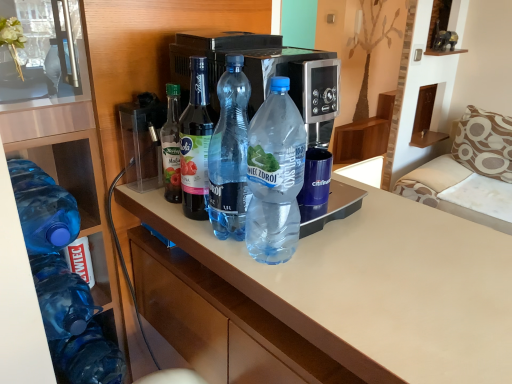
Measure the distance between blue translucent bottle at center, which is counted as the 5th bottle, starting from the left, and camera.

blue translucent bottle at center, which is counted as the 5th bottle, starting from the left, and camera are 24.75 inches apart from each other.

At what (x,y) coordinates should I click in order to perform the action: click on blue plastic bottles at left. Please return your answer as a coordinate pair (x, y). Looking at the image, I should click on (66, 140).

This screenshot has height=384, width=512. Describe the element at coordinates (66, 140) in the screenshot. I see `blue plastic bottles at left` at that location.

What do you see at coordinates (229, 153) in the screenshot? I see `transparent plastic bottle at center, the second bottle when ordered from right to left` at bounding box center [229, 153].

Find the location of a particular element. The width and height of the screenshot is (512, 384). blue translucent bottle at center, which appears as the 1th bottle when viewed from the right is located at coordinates (275, 176).

Is point (213, 120) less distant than point (213, 226)?

Yes, point (213, 120) is in front of point (213, 226).

Could you measure the distance between transparent plastic bottle at center, which is the 3th bottle from left to right, and transparent plastic bottle at center, the 4th bottle when ordered from left to right?

The distance of transparent plastic bottle at center, which is the 3th bottle from left to right, from transparent plastic bottle at center, the 4th bottle when ordered from left to right, is 7.46 centimeters.

Is transparent plastic bottle at center, the 4th bottle when ordered from left to right, located within transparent plastic bottle at center, which is counted as the third bottle, starting from the right?

That's incorrect, transparent plastic bottle at center, the 4th bottle when ordered from left to right, is not inside transparent plastic bottle at center, which is counted as the third bottle, starting from the right.

Locate an element on the screen. bottle that is the 1st one when counting downward from the transparent plastic container at upper left (from the image's perspective) is located at coordinates (196, 142).

Is transparent plastic container at upper left at the back of transparent plastic bottle at center, which is the 3th bottle from left to right?

That's right, transparent plastic bottle at center, which is the 3th bottle from left to right, is facing away from transparent plastic container at upper left.

Considering the relative sizes of transparent plastic bottle at center, which is counted as the third bottle, starting from the right, and transparent plastic container at upper left in the image provided, is transparent plastic bottle at center, which is counted as the third bottle, starting from the right, smaller than transparent plastic container at upper left?

Correct, transparent plastic bottle at center, which is counted as the third bottle, starting from the right, occupies less space than transparent plastic container at upper left.

Does point (67, 334) come in front of point (13, 181)?

No, it is behind (13, 181).

Is blue translucent bottle at left, which ranks as the 4th bottle in right-to-left order, at the left side of blue translucent bottle at left, the 1th bottle in the left-to-right sequence?

No.

Based on the photo, is blue translucent bottle at left, the 1th bottle in the left-to-right sequence, completely or partially inside blue translucent bottle at left, which ranks as the 4th bottle in right-to-left order?

No, blue translucent bottle at left, the 1th bottle in the left-to-right sequence, is not surrounded by blue translucent bottle at left, which ranks as the 4th bottle in right-to-left order.

This screenshot has height=384, width=512. In the image, there is a transparent plastic container at upper left. What are the coordinates of `furniture below it (from the image's perspective)` in the screenshot? It's located at (470, 173).

From a real-world perspective, is beige fabric sofa at right physically above transparent plastic container at upper left?

Incorrect, from a real-world perspective, beige fabric sofa at right is lower than transparent plastic container at upper left.

Based on the photo, does beige fabric sofa at right have a lesser width compared to transparent plastic container at upper left?

In fact, beige fabric sofa at right might be wider than transparent plastic container at upper left.

From the picture: Could you tell me if beige fabric sofa at right is turned towards transparent plastic container at upper left?

Yes.

Is transparent plastic bottle at center, which is the 3th bottle from left to right, in contact with blue plastic bottles at left?

transparent plastic bottle at center, which is the 3th bottle from left to right, and blue plastic bottles at left are clearly separated.

From a real-world perspective, which is physically below, transparent plastic bottle at center, which is the 3th bottle from left to right, or blue plastic bottles at left?

blue plastic bottles at left, from a real-world perspective.

Is transparent plastic bottle at center, which is counted as the third bottle, starting from the right, wider or thinner than blue plastic bottles at left?

Considering their sizes, transparent plastic bottle at center, which is counted as the third bottle, starting from the right, looks slimmer than blue plastic bottles at left.

Is blue plastic bottles at left located within transparent plastic bottle at center, which is counted as the third bottle, starting from the right?

Actually, blue plastic bottles at left is outside transparent plastic bottle at center, which is counted as the third bottle, starting from the right.

Which object is further away from the camera, transparent plastic bottle at center, the 4th bottle when ordered from left to right, or transparent plastic container at upper left?

transparent plastic container at upper left is further from the camera.

Between transparent plastic bottle at center, the second bottle when ordered from right to left, and transparent plastic container at upper left, which one has less height?

With less height is transparent plastic container at upper left.

From a real-world perspective, between transparent plastic bottle at center, the second bottle when ordered from right to left, and transparent plastic container at upper left, who is vertically lower?

transparent plastic container at upper left is physically lower.

In terms of width, does translucent plastic bottles at center look wider or thinner when compared to brown printed fabric pillow at right?

translucent plastic bottles at center is wider than brown printed fabric pillow at right.

Which is in front, point (115, 195) or point (463, 139)?

The point (115, 195) is more forward.

Would you say translucent plastic bottles at center is outside brown printed fabric pillow at right?

translucent plastic bottles at center is positioned outside brown printed fabric pillow at right.

From the image's perspective, starting from the transparent plastic bottle at center, which is the 3th bottle from left to right, which bottle is the 1st one below? Please provide its 2D coordinates.

[(229, 153)]

The height and width of the screenshot is (384, 512). I want to click on appliance behind the transparent plastic bottle at center, which is the 3th bottle from left to right, so click(x=142, y=141).

Which object lies nearer to the anchor point blue translucent bottle at left, placed as the second bottle when sorted from left to right, beige fabric sofa at right or blue translucent bottle at center, which is counted as the 5th bottle, starting from the left?

The object closer to blue translucent bottle at left, placed as the second bottle when sorted from left to right, is blue translucent bottle at center, which is counted as the 5th bottle, starting from the left.

Looking at the image, which one is located further to transparent plastic bottle at center, the second bottle when ordered from right to left, brown printed fabric pillow at right or translucent plastic bottles at center?

The object further to transparent plastic bottle at center, the second bottle when ordered from right to left, is brown printed fabric pillow at right.

Estimate the real-world distances between objects in this image. Which object is closer to brown printed fabric pillow at right, transparent plastic container at upper left or translucent plastic bottles at center?

translucent plastic bottles at center is closer to brown printed fabric pillow at right.

Based on the photo, when comparing their distances from transparent plastic container at upper left, does blue translucent bottle at left, the 1th bottle in the left-to-right sequence, or blue plastic bottles at left seem further?

blue translucent bottle at left, the 1th bottle in the left-to-right sequence.

Based on their spatial positions, is translucent plastic bottles at center or transparent plastic container at upper left further from beige fabric sofa at right?

transparent plastic container at upper left is positioned further to the anchor beige fabric sofa at right.

Based on their spatial positions, is blue translucent bottle at left, the 1th bottle in the left-to-right sequence, or transparent plastic bottle at center, which is counted as the third bottle, starting from the right, further from transparent plastic bottle at center, the second bottle when ordered from right to left?

blue translucent bottle at left, the 1th bottle in the left-to-right sequence, is positioned further to the anchor transparent plastic bottle at center, the second bottle when ordered from right to left.

Considering their positions, is blue translucent bottle at left, the 5th bottle viewed from the right, positioned closer to transparent plastic container at upper left than transparent plastic bottle at center, which is the 3th bottle from left to right?

transparent plastic bottle at center, which is the 3th bottle from left to right.

Based on their spatial positions, is translucent plastic bottles at center or transparent plastic container at upper left closer to transparent plastic bottle at center, the second bottle when ordered from right to left?

translucent plastic bottles at center lies closer to transparent plastic bottle at center, the second bottle when ordered from right to left, than the other object.

This screenshot has width=512, height=384. Identify the location of cabinetry between blue translucent bottle at left, the 5th bottle viewed from the right, and blue translucent bottle at left, which ranks as the 4th bottle in right-to-left order, in the up-down direction. (66, 140).

Find the location of a particular element. This screenshot has height=384, width=512. furniture between translucent plastic bottles at center and brown printed fabric pillow at right along the z-axis is located at coordinates (470, 173).

Locate an element on the screen. This screenshot has width=512, height=384. appliance situated between blue translucent bottle at left, placed as the second bottle when sorted from left to right, and brown printed fabric pillow at right from left to right is located at coordinates (142, 141).

What are the coordinates of `furniture between transparent plastic bottle at center, the second bottle when ordered from right to left, and brown printed fabric pillow at right in the front-back direction` in the screenshot? It's located at (470, 173).